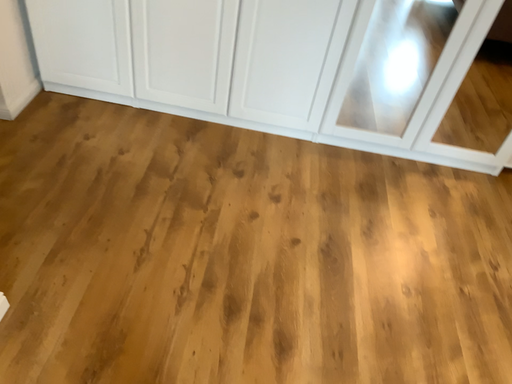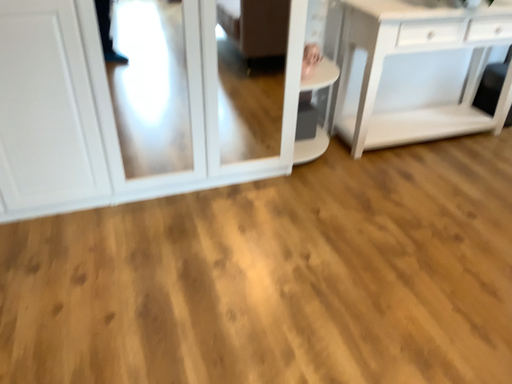
Question: How did the camera likely rotate when shooting the video?

Choices:
 (A) rotated downward
 (B) rotated upward

Answer: (B)